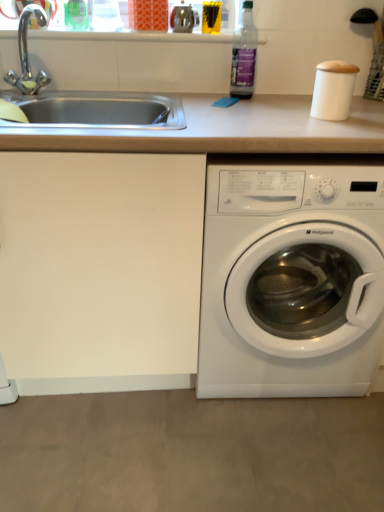
This screenshot has width=384, height=512. I want to click on white plastic washing machine at lower right, so click(x=291, y=281).

The width and height of the screenshot is (384, 512). Describe the element at coordinates (244, 55) in the screenshot. I see `transparent plastic bottle at upper right` at that location.

I want to click on white plastic washing machine at lower right, so click(291, 281).

How many degrees apart are the facing directions of chrome metallic faucet at upper left and transparent plastic bottle at upper right?

The facing directions of chrome metallic faucet at upper left and transparent plastic bottle at upper right are 1.15 degrees apart.

Are chrome metallic faucet at upper left and transparent plastic bottle at upper right far apart?

No, chrome metallic faucet at upper left is not far away from transparent plastic bottle at upper right.

From a real-world perspective, who is located lower, chrome metallic faucet at upper left or transparent plastic bottle at upper right?

In real-world perspective, chrome metallic faucet at upper left is lower.

Between white plastic washing machine at lower right and chrome metallic faucet at upper left, which one appears on the left side from the viewer's perspective?

From the viewer's perspective, chrome metallic faucet at upper left appears more on the left side.

Is chrome metallic faucet at upper left at the back of white plastic washing machine at lower right?

No, white plastic washing machine at lower right is not facing the opposite direction of chrome metallic faucet at upper left.

Does white plastic washing machine at lower right touch chrome metallic faucet at upper left?

white plastic washing machine at lower right and chrome metallic faucet at upper left are clearly separated.

Which object is further away from the camera, white plastic washing machine at lower right or chrome metallic faucet at upper left?

chrome metallic faucet at upper left is further from the camera.

Is chrome metallic faucet at upper left aimed at white plastic washing machine at lower right?

No, chrome metallic faucet at upper left is not facing towards white plastic washing machine at lower right.

Is chrome metallic faucet at upper left surrounding white plastic washing machine at lower right?

No, white plastic washing machine at lower right is not inside chrome metallic faucet at upper left.

Considering the positions of points (20, 23) and (350, 309), is point (20, 23) closer to camera compared to point (350, 309)?

No, it is behind (350, 309).

Who is smaller, chrome metallic faucet at upper left or white plastic washing machine at lower right?

With smaller size is chrome metallic faucet at upper left.

What's the angular difference between transparent plastic bottle at upper right and white plastic washing machine at lower right's facing directions?

They differ by 0.478 degrees in their facing directions.

Based on the photo, can you confirm if transparent plastic bottle at upper right is smaller than white plastic washing machine at lower right?

Correct, transparent plastic bottle at upper right occupies less space than white plastic washing machine at lower right.

From the image's perspective, which one is positioned lower, transparent plastic bottle at upper right or white plastic washing machine at lower right?

white plastic washing machine at lower right is shown below in the image.

Is transparent plastic bottle at upper right not within white plastic washing machine at lower right?

transparent plastic bottle at upper right is positioned outside white plastic washing machine at lower right.

From the image's perspective, which is below, white matte counter top at center or transparent plastic bottle at upper right?

white matte counter top at center, from the image's perspective.

Between white matte counter top at center and transparent plastic bottle at upper right, which one has less height?

With less height is transparent plastic bottle at upper right.

Does point (367, 140) appear closer or farther from the camera than point (250, 1)?

Point (367, 140) is positioned closer to the camera compared to point (250, 1).

Is white matte counter top at center facing away from transparent plastic bottle at upper right?

white matte counter top at center is not turned away from transparent plastic bottle at upper right.

Considering the sizes of objects white plastic washing machine at lower right and white matte counter top at center in the image provided, who is thinner, white plastic washing machine at lower right or white matte counter top at center?

Thinner between the two is white matte counter top at center.

What's the angular difference between white plastic washing machine at lower right and white matte counter top at center's facing directions?

The facing directions of white plastic washing machine at lower right and white matte counter top at center are 0.477 degrees apart.

Does white plastic washing machine at lower right lie in front of white matte counter top at center?

No, it is not.

Consider the image. Can white matte counter top at center be found inside white plastic washing machine at lower right?

Yes, white plastic washing machine at lower right is surrounding white matte counter top at center.

Which is in front, transparent plastic bottle at upper right or white matte counter top at center?

white matte counter top at center is closer to the camera.

Does transparent plastic bottle at upper right have a smaller size compared to white matte counter top at center?

Yes, transparent plastic bottle at upper right is smaller than white matte counter top at center.

From the image's perspective, who appears lower, transparent plastic bottle at upper right or white matte counter top at center?

white matte counter top at center is shown below in the image.

Which is less distant, (249,62) or (164,332)?

Point (249,62) is farther from the camera than point (164,332).

Image resolution: width=384 pixels, height=512 pixels. In order to click on bottle above the chrome metallic faucet at upper left (from the image's perspective) in this screenshot , I will do `click(244, 55)`.

Image resolution: width=384 pixels, height=512 pixels. Find the location of `washing machine on the right of chrome metallic faucet at upper left`. washing machine on the right of chrome metallic faucet at upper left is located at coordinates (291, 281).

Looking at the image, which one is located closer to transparent plastic bottle at upper right, white plastic washing machine at lower right or white matte counter top at center?

white plastic washing machine at lower right is closer to transparent plastic bottle at upper right.

Estimate the real-world distances between objects in this image. Which object is closer to white matte counter top at center, white plastic washing machine at lower right or transparent plastic bottle at upper right?

The object closer to white matte counter top at center is white plastic washing machine at lower right.

Based on their spatial positions, is chrome metallic faucet at upper left or white plastic washing machine at lower right closer to transparent plastic bottle at upper right?

chrome metallic faucet at upper left.

From the image, which object appears to be nearer to chrome metallic faucet at upper left, white plastic washing machine at lower right or transparent plastic bottle at upper right?

transparent plastic bottle at upper right is closer to chrome metallic faucet at upper left.

From the image, which object appears to be farther from white matte counter top at center, white plastic washing machine at lower right or chrome metallic faucet at upper left?

Based on the image, chrome metallic faucet at upper left appears to be further to white matte counter top at center.

From the image, which object appears to be farther from transparent plastic bottle at upper right, chrome metallic faucet at upper left or white matte counter top at center?

white matte counter top at center lies further to transparent plastic bottle at upper right than the other object.

From the image, which object appears to be farther from white plastic washing machine at lower right, white matte counter top at center or transparent plastic bottle at upper right?

transparent plastic bottle at upper right is positioned further to the anchor white plastic washing machine at lower right.

When comparing their distances from chrome metallic faucet at upper left, does transparent plastic bottle at upper right or white matte counter top at center seem further?

white matte counter top at center lies further to chrome metallic faucet at upper left than the other object.

You are a GUI agent. You are given a task and a screenshot of the screen. Output one action in this format:
    pyautogui.click(x=<x>, y=<y>)
    Task: Click on the counter top between chrome metallic faucet at upper left and white plastic washing machine at lower right
    This screenshot has height=512, width=384.
    Given the screenshot: What is the action you would take?
    [129, 239]

Find the location of `bottle situated between chrome metallic faucet at upper left and white plastic washing machine at lower right from left to right`. bottle situated between chrome metallic faucet at upper left and white plastic washing machine at lower right from left to right is located at coordinates (244, 55).

Find the location of a particular element. The height and width of the screenshot is (512, 384). counter top situated between chrome metallic faucet at upper left and transparent plastic bottle at upper right from left to right is located at coordinates (129, 239).

The width and height of the screenshot is (384, 512). Identify the location of counter top between transparent plastic bottle at upper right and white plastic washing machine at lower right vertically. (129, 239).